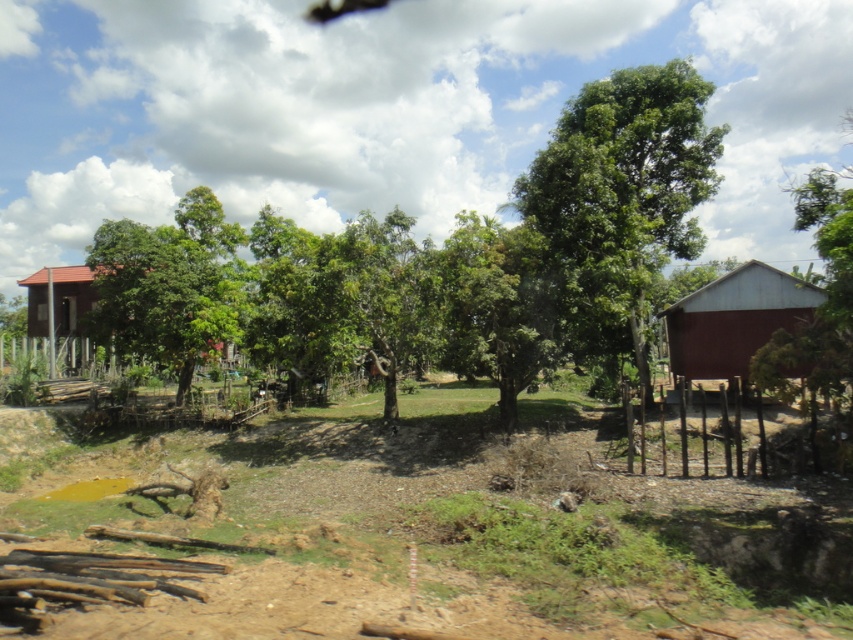
You are a gardener standing in the middle of the green leafy tree at center and the matte red wooden hut at left. Which object is closer to your current position?

The green leafy tree at center is positioned on the right side of the matte red wooden hut at left, so the matte red wooden hut at left is closer to your current position in the middle.

You are standing at the point labeled as point (621, 193) in the image. What object are you directly facing?

You are directly facing the green leafy tree at center, as the point (621, 193) corresponds to that location.